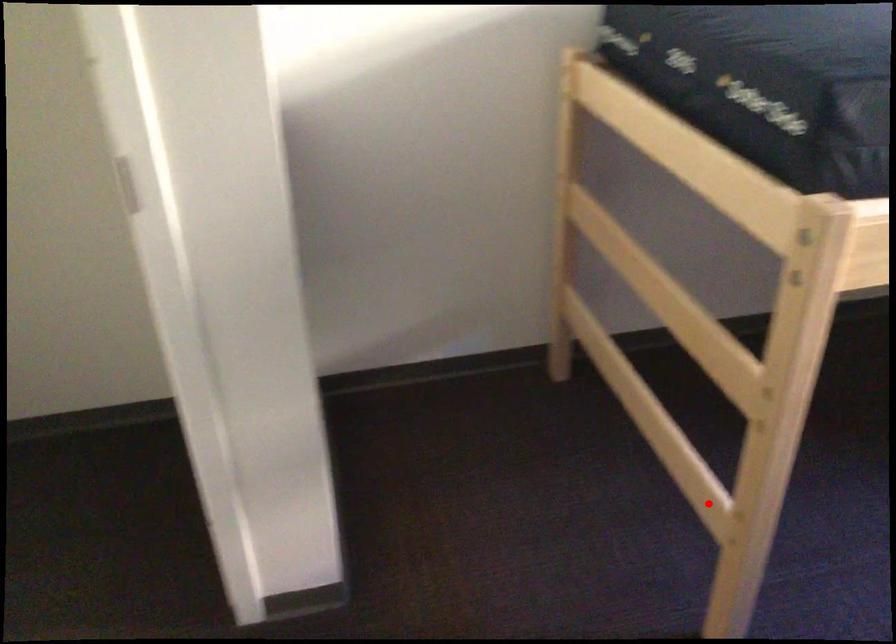
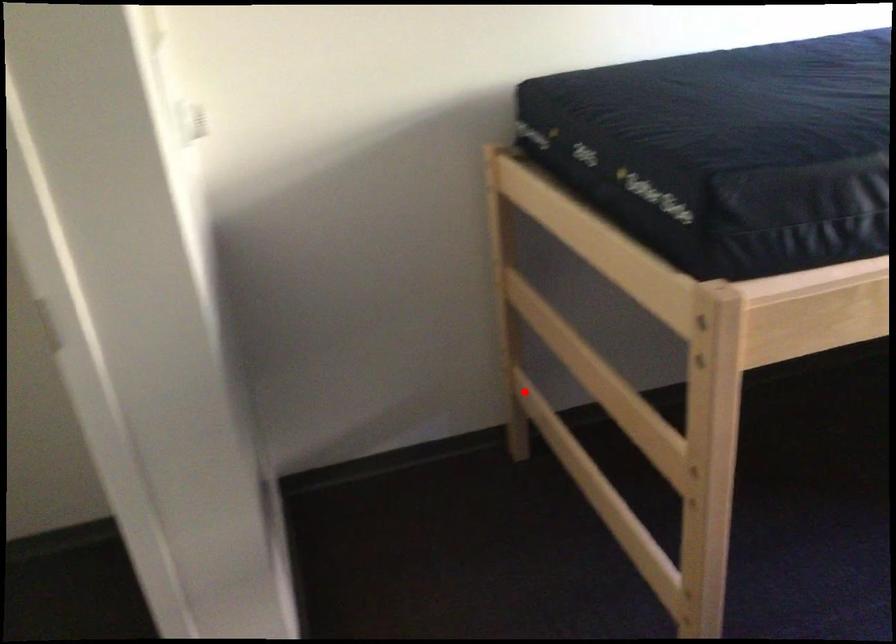
I am providing you with two images of the same scene from different viewpoints. A red point is marked on the first image and another point is marked on the second image. Are the points marked in image1 and image2 representing the same 3D position?

No